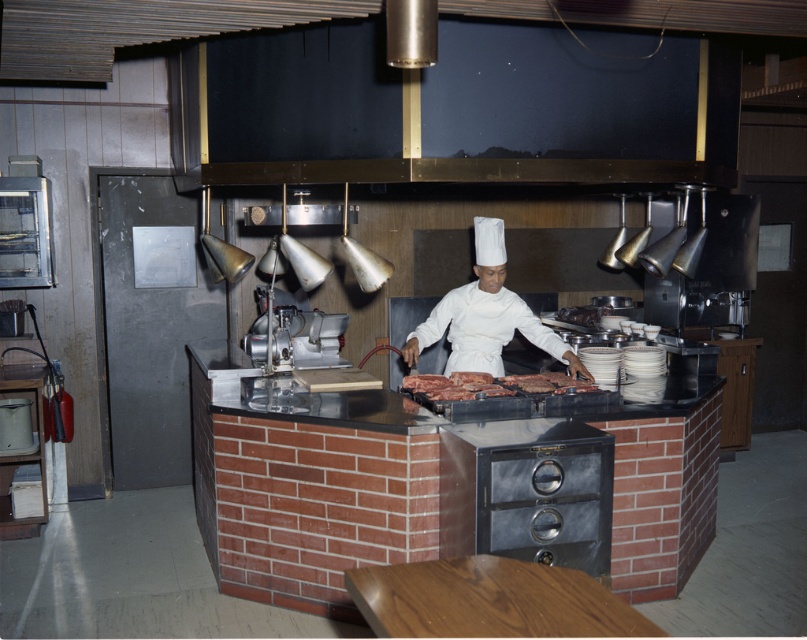
Question: Which point is farther to the camera?

Choices:
 (A) white chef's uniform at center
 (B) dark brown meat at center

Answer: (A)

Question: Among these points, which one is farthest from the camera?

Choices:
 (A) (484, 252)
 (B) (513, 381)

Answer: (A)

Question: Is white chef's uniform at center bigger than dark brown meat at center?

Choices:
 (A) yes
 (B) no

Answer: (A)

Question: Does white chef's uniform at center appear under dark brown meat at center?

Choices:
 (A) yes
 (B) no

Answer: (B)

Question: Does white chef's uniform at center appear over dark brown meat at center?

Choices:
 (A) yes
 (B) no

Answer: (A)